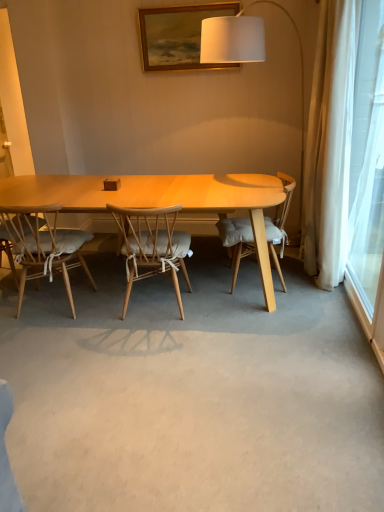
You are a GUI agent. You are given a task and a screenshot of the screen. Output one action in this format:
    pyautogui.click(x=<x>, y=<y>)
    Task: Click on the vacant region in front of light wood chair with cushion at center, the 1th chair positioned from the right
    
    Given the screenshot: What is the action you would take?
    pyautogui.click(x=261, y=317)